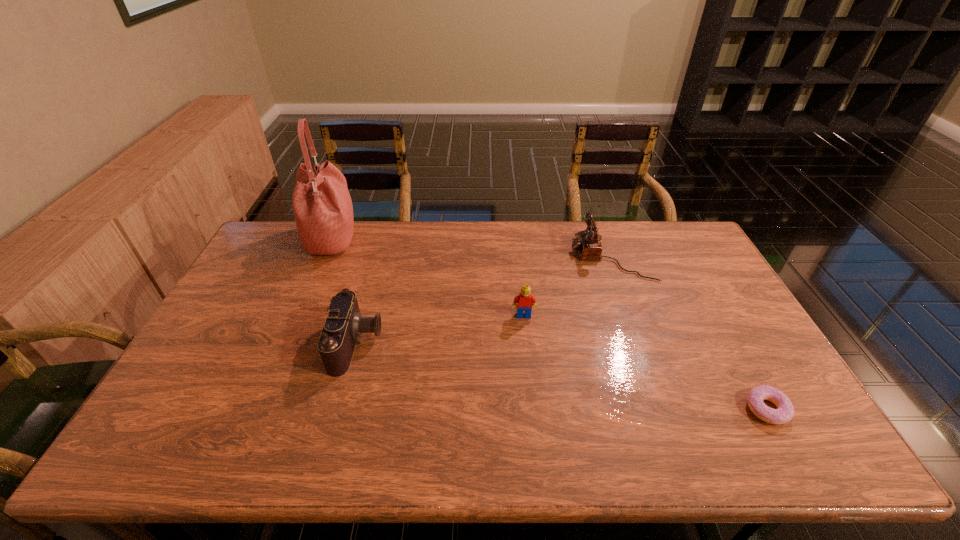
Identify the location of vacant space located 0.160m on the dial of the second object from right to left. The width and height of the screenshot is (960, 540). (526, 257).

Where is `blank space located on the front-facing side of the fourth object from right to left`? The height and width of the screenshot is (540, 960). blank space located on the front-facing side of the fourth object from right to left is located at coordinates (469, 343).

This screenshot has height=540, width=960. I want to click on free spot located on the face of the third object from left to right, so click(x=533, y=403).

Identify the location of vacant space located 0.260m on the left of the nearest object. (640, 409).

At what (x,y) coordinates should I click in order to perform the action: click on handbag that is at the far edge. Please return your answer as a coordinate pair (x, y). Looking at the image, I should click on (322, 206).

This screenshot has height=540, width=960. I want to click on telephone at the far edge, so click(588, 244).

Where is `object that is at the near edge`? object that is at the near edge is located at coordinates (784, 413).

Find the location of a particular element. The width and height of the screenshot is (960, 540). object that is at the left edge is located at coordinates (322, 206).

What are the coordinates of `object that is at the right edge` in the screenshot? It's located at (784, 413).

At what (x,y) coordinates should I click in order to perform the action: click on object that is at the far left corner. Please return your answer as a coordinate pair (x, y). The image size is (960, 540). Looking at the image, I should click on (322, 206).